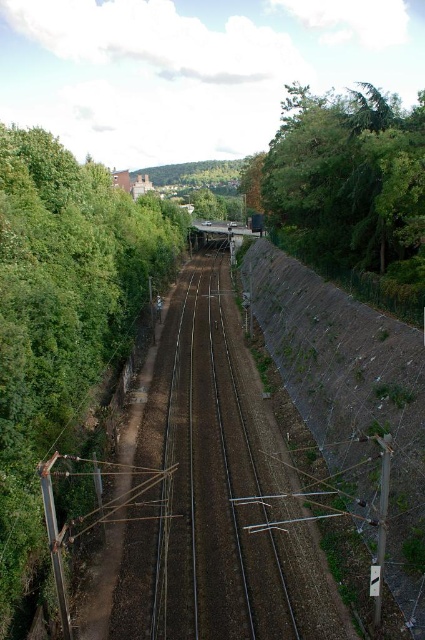
Question: Which point is farther to the camera?

Choices:
 (A) (397, 433)
 (B) (226, 273)

Answer: (B)

Question: Which point is closer to the camera?

Choices:
 (A) green leafy tree at left
 (B) brown dirt train track at center
 (C) brown textured hillside at right
 (D) green leafy tree at right

Answer: (A)

Question: Which of the following is the farthest from the observer?

Choices:
 (A) green leafy tree at left
 (B) green leafy tree at right
 (C) brown textured hillside at right
 (D) brown dirt train track at center

Answer: (B)

Question: Observing the image, what is the correct spatial positioning of brown textured hillside at right in reference to green leafy tree at right?

Choices:
 (A) right
 (B) left

Answer: (B)

Question: Is the position of brown dirt train track at center less distant than that of brown textured hillside at right?

Choices:
 (A) yes
 (B) no

Answer: (B)

Question: Is brown textured hillside at right positioned before green leafy tree at right?

Choices:
 (A) no
 (B) yes

Answer: (B)